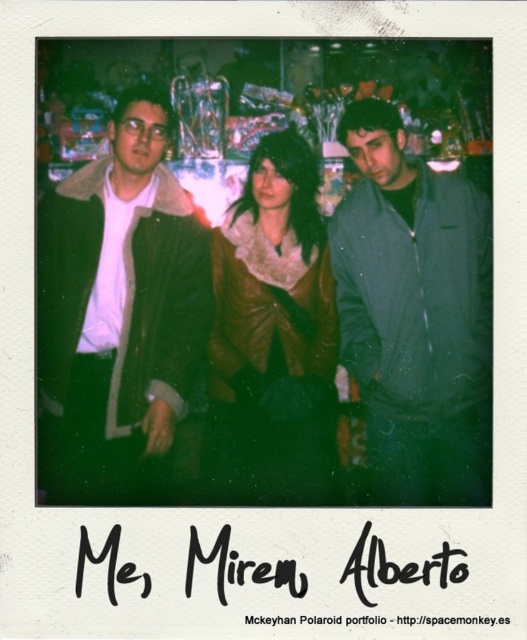
Does point (92, 400) come behind point (264, 467)?

No, it is not.

Is matte brown jacket at left to the left of brown leather jacket at center from the viewer's perspective?

Correct, you'll find matte brown jacket at left to the left of brown leather jacket at center.

Where is `matte brown jacket at left`? This screenshot has height=640, width=527. matte brown jacket at left is located at coordinates (118, 314).

Who is lower down, matte brown jacket at left or matte green jacket at center?

Positioned lower is matte green jacket at center.

Is matte brown jacket at left closer to the viewer compared to matte green jacket at center?

That is False.

Is point (128, 317) positioned behind point (339, 266)?

No, it is in front of (339, 266).

The image size is (527, 640). I want to click on matte brown jacket at left, so click(118, 314).

Where is `matte green jacket at center`? The width and height of the screenshot is (527, 640). matte green jacket at center is located at coordinates (415, 314).

Does point (491, 356) come farther from viewer compared to point (326, 492)?

No, it is in front of (326, 492).

In order to click on matte green jacket at center in this screenshot , I will do `click(415, 314)`.